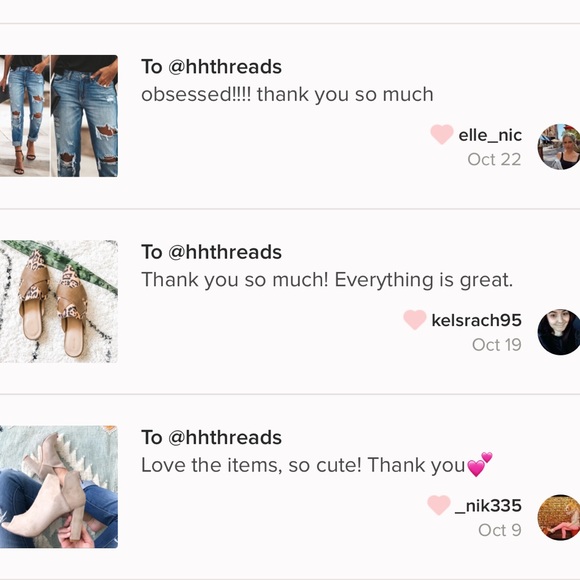
Where is `white carpet with green accent`? white carpet with green accent is located at coordinates (99, 298).